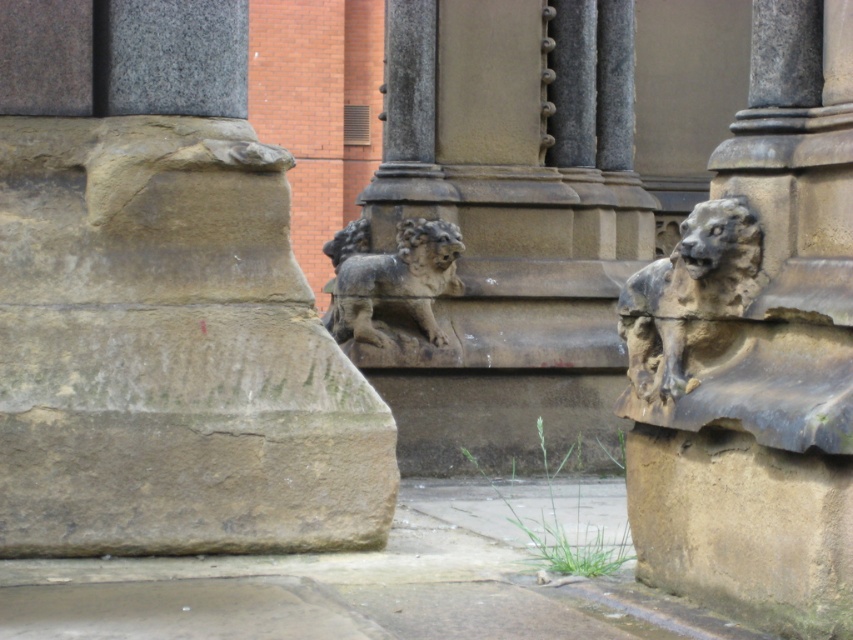
Who is shorter, brown stone lion at left or rough stone gargoyle at center?

rough stone gargoyle at center is shorter.

Can you confirm if brown stone lion at left is positioned to the left of rough stone gargoyle at center?

Yes, brown stone lion at left is to the left of rough stone gargoyle at center.

Between point (131, 157) and point (804, 60), which one is positioned in front?

Point (804, 60) is more forward.

Identify the location of brown stone lion at left. The height and width of the screenshot is (640, 853). (161, 304).

Is brown stone lion at left taller than gray stone lion at center?

Indeed, brown stone lion at left has a greater height compared to gray stone lion at center.

How distant is brown stone lion at left from gray stone lion at center?

brown stone lion at left is 4.85 meters away from gray stone lion at center.

Between point (62, 80) and point (335, 291), which one is positioned in front?

Point (62, 80)

This screenshot has height=640, width=853. I want to click on brown stone lion at left, so click(x=161, y=304).

Can you confirm if brown stone lion at left is bigger than weathered stone lion at right?

Yes, brown stone lion at left is bigger than weathered stone lion at right.

Is brown stone lion at left to the right of weathered stone lion at right from the viewer's perspective?

Incorrect, brown stone lion at left is not on the right side of weathered stone lion at right.

Where is `brown stone lion at left`? brown stone lion at left is located at coordinates (161, 304).